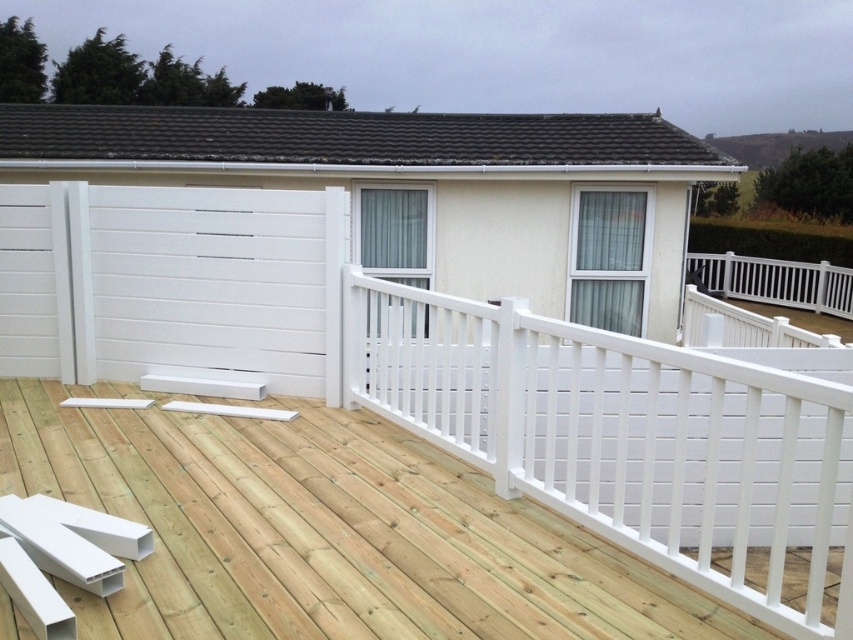
Looking at this image, you are a contractor looking at the deck construction site. You see the natural wood deck at center and the white painted wood rail at upper center. Which object is positioned to the left when viewed from the front of the deck?

The natural wood deck at center is positioned to the left of the white painted wood rail at upper center.